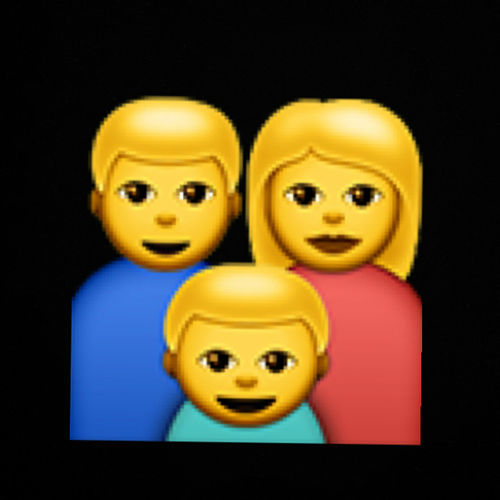
The width and height of the screenshot is (500, 500). I want to click on corner, so point(80,433), point(414,439).